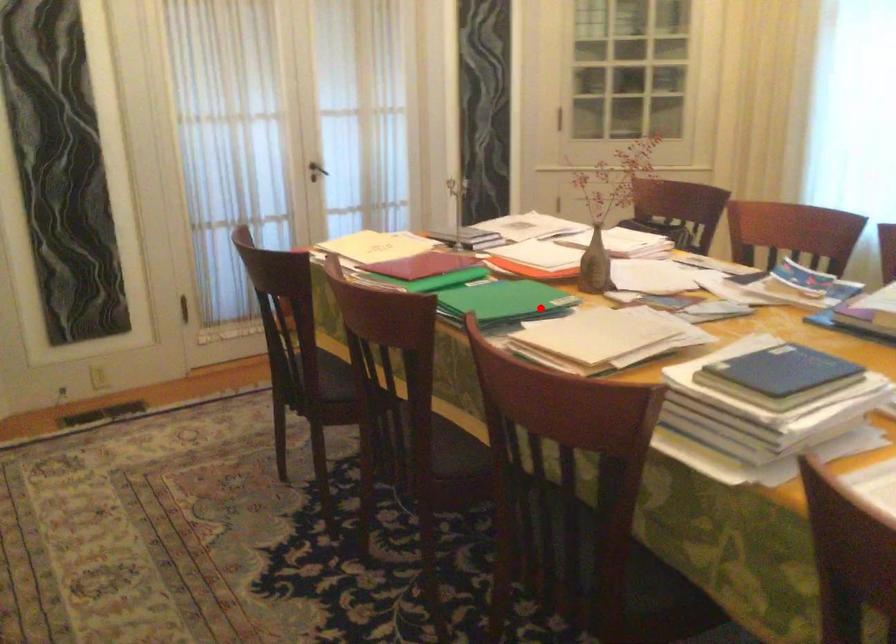
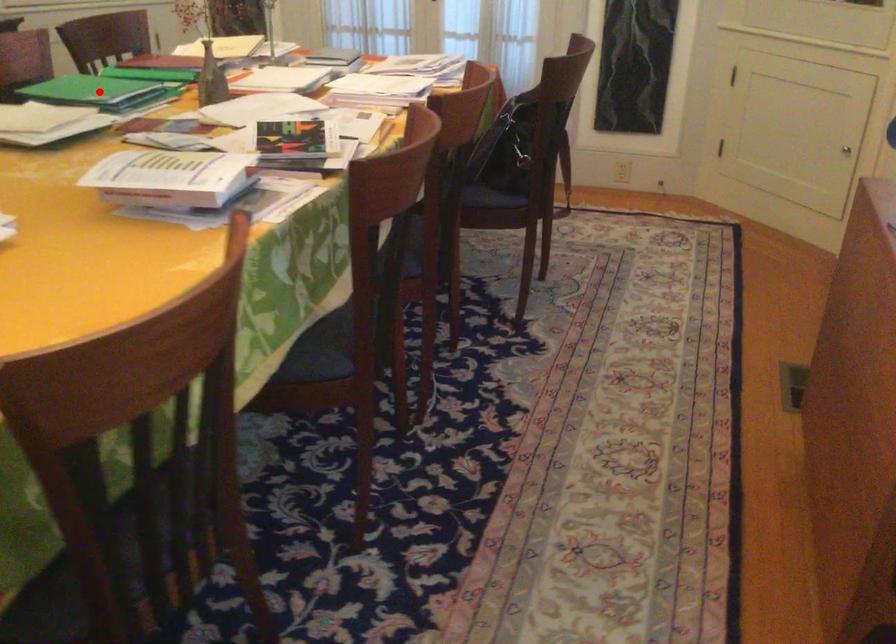
I am providing you with two images of the same scene from different viewpoints. A red point is marked on the first image and another point is marked on the second image. Is the red point in image1 aligned with the point shown in image2?

Yes